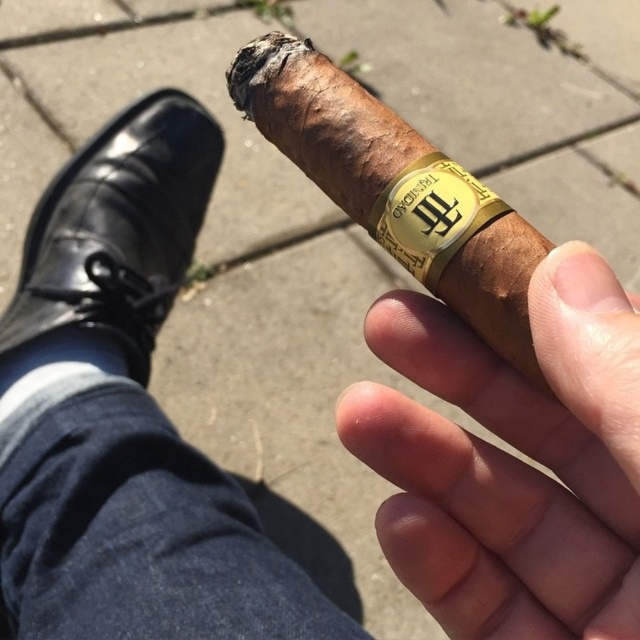
Is smooth skin at center behind black leather shoe at lower left?

No, smooth skin at center is in front of black leather shoe at lower left.

Does smooth skin at center have a greater height compared to black leather shoe at lower left?

Incorrect, smooth skin at center's height is not larger of black leather shoe at lower left's.

Find the location of a particular element. This screenshot has width=640, height=640. smooth skin at center is located at coordinates (512, 460).